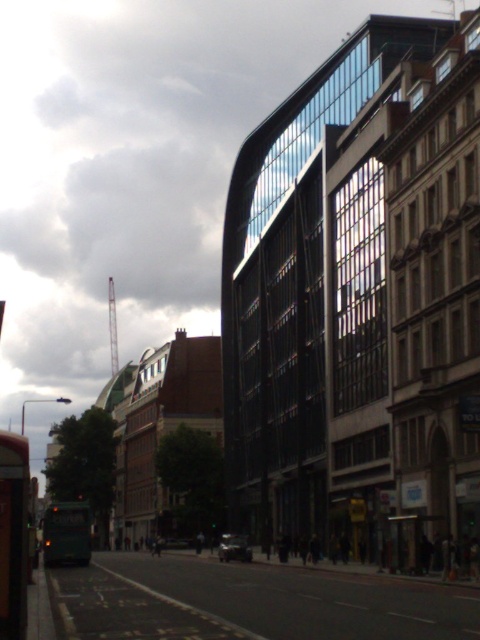
The height and width of the screenshot is (640, 480). What do you see at coordinates (250, 602) in the screenshot?
I see `black asphalt road at center` at bounding box center [250, 602].

Is black asphalt road at center thinner than green matte bus at lower left?

In fact, black asphalt road at center might be wider than green matte bus at lower left.

Who is more forward, [236,568] or [57,536]?

Point [57,536] is more forward.

Locate an element on the screen. The image size is (480, 640). black asphalt road at center is located at coordinates (250, 602).